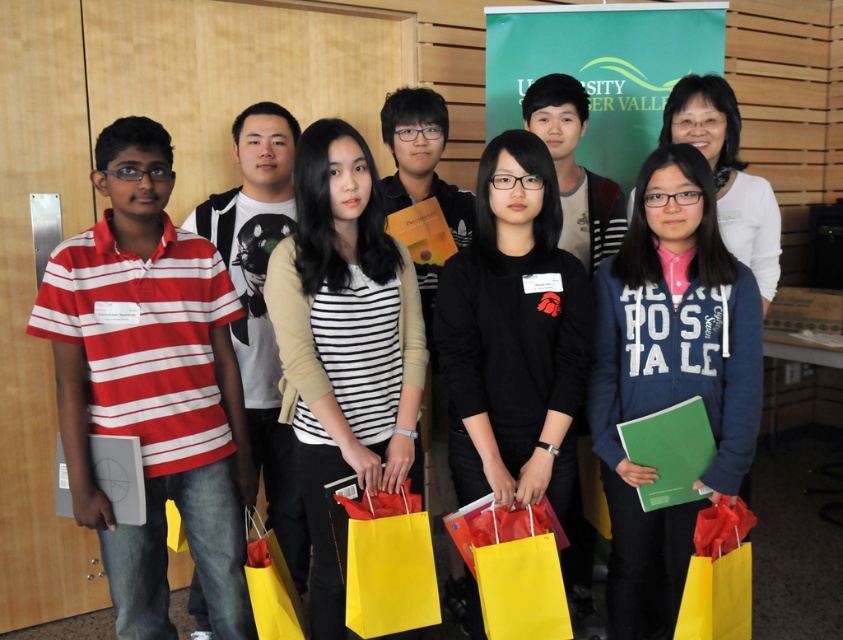
Can you confirm if black matte shirt at center is positioned to the left of yellow paper shopping bag at lower left?

No, black matte shirt at center is not to the left of yellow paper shopping bag at lower left.

Can you confirm if black matte shirt at center is wider than yellow paper shopping bag at lower left?

Correct, the width of black matte shirt at center exceeds that of yellow paper shopping bag at lower left.

Is point (479, 298) more distant than point (285, 618)?

No.

Locate an element on the screen. The image size is (843, 640). black matte shirt at center is located at coordinates (514, 333).

Which is more to the right, blue fleece jacket at center or black matte shirt at center?

blue fleece jacket at center is more to the right.

Can you confirm if blue fleece jacket at center is bigger than black matte shirt at center?

Indeed, blue fleece jacket at center has a larger size compared to black matte shirt at center.

What do you see at coordinates (669, 376) in the screenshot? I see `blue fleece jacket at center` at bounding box center [669, 376].

This screenshot has height=640, width=843. What are the coordinates of `blue fleece jacket at center` in the screenshot? It's located at (669, 376).

Between red striped polo shirt at left and black matte shirt at center, which one appears on the left side from the viewer's perspective?

red striped polo shirt at left is more to the left.

Is point (121, 140) closer to camera compared to point (503, 282)?

Yes, point (121, 140) is in front of point (503, 282).

Is point (122, 364) positioned behind point (511, 420)?

No, (122, 364) is in front of (511, 420).

You are a GUI agent. You are given a task and a screenshot of the screen. Output one action in this format:
    pyautogui.click(x=<x>, y=<y>)
    Task: Click on the red striped polo shirt at left
    The width and height of the screenshot is (843, 640).
    Given the screenshot: What is the action you would take?
    pyautogui.click(x=151, y=385)